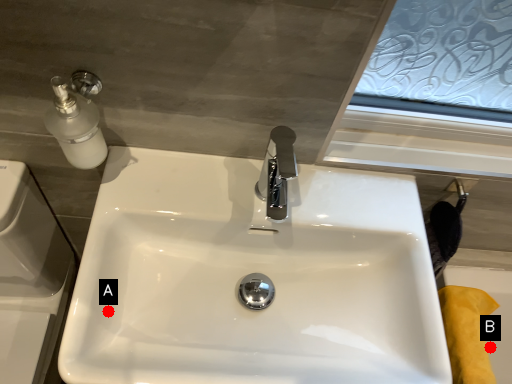
Question: Two points are circled on the image, labeled by A and B beside each circle. Among these points, which one is nearest to the camera?

Choices:
 (A) A is closer
 (B) B is closer

Answer: (A)